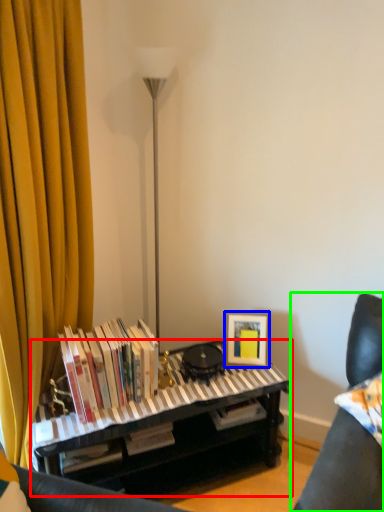
Question: Which is nearer to the piano (highlighted by a red box)? picture frame (highlighted by a blue box) or furniture (highlighted by a green box).

Choices:
 (A) picture frame
 (B) furniture

Answer: (A)